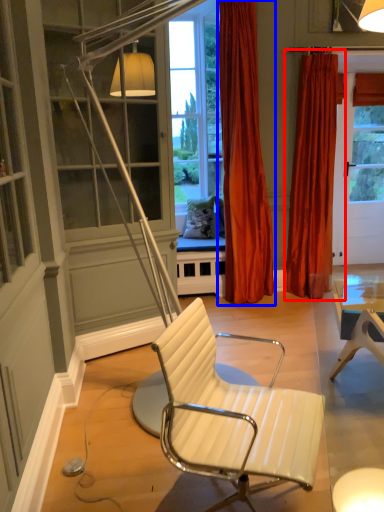
Question: Which of the following is the farthest to the observer, curtain (highlighted by a red box) or curtain (highlighted by a blue box)?

Choices:
 (A) curtain
 (B) curtain

Answer: (A)